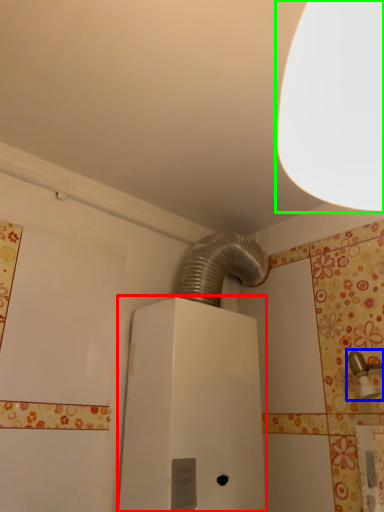
Question: Which object is the closest to the water heater (highlighted by a red box)? Choose among these: plumbing fixture (highlighted by a blue box) or lamp (highlighted by a green box).

Choices:
 (A) plumbing fixture
 (B) lamp

Answer: (A)